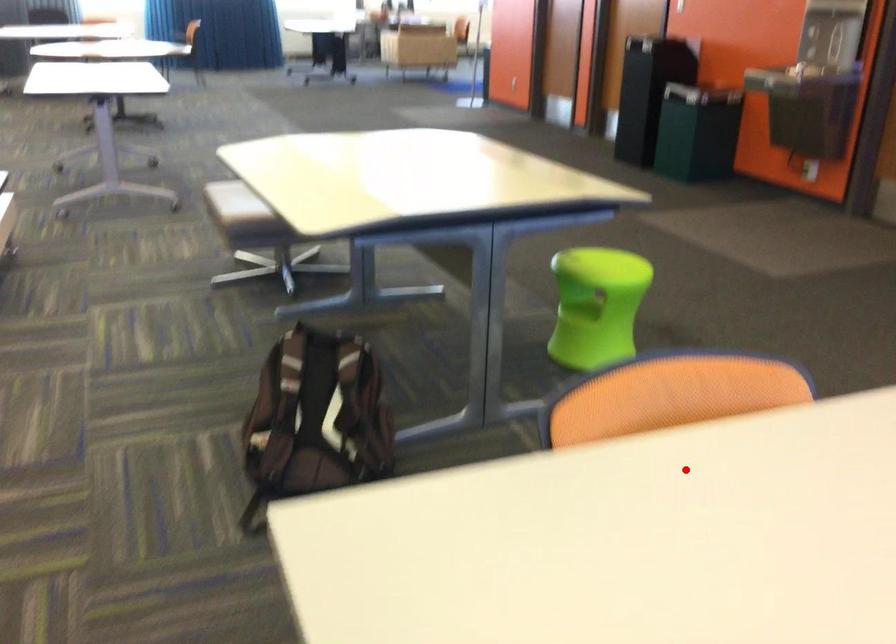
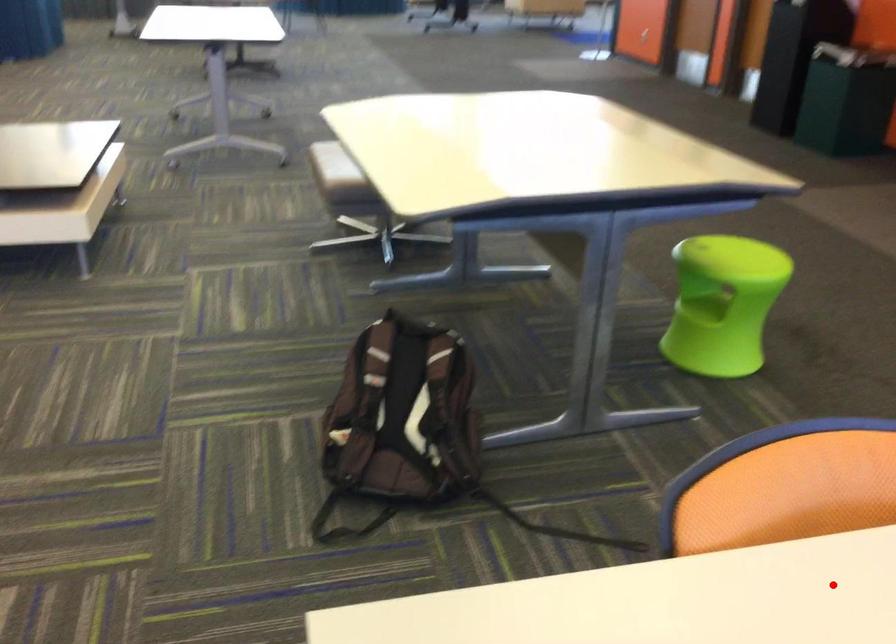
I am providing you with two images of the same scene from different viewpoints. A red point is marked on the first image and another point is marked on the second image. Is the red point in image1 aligned with the point shown in image2?

Yes